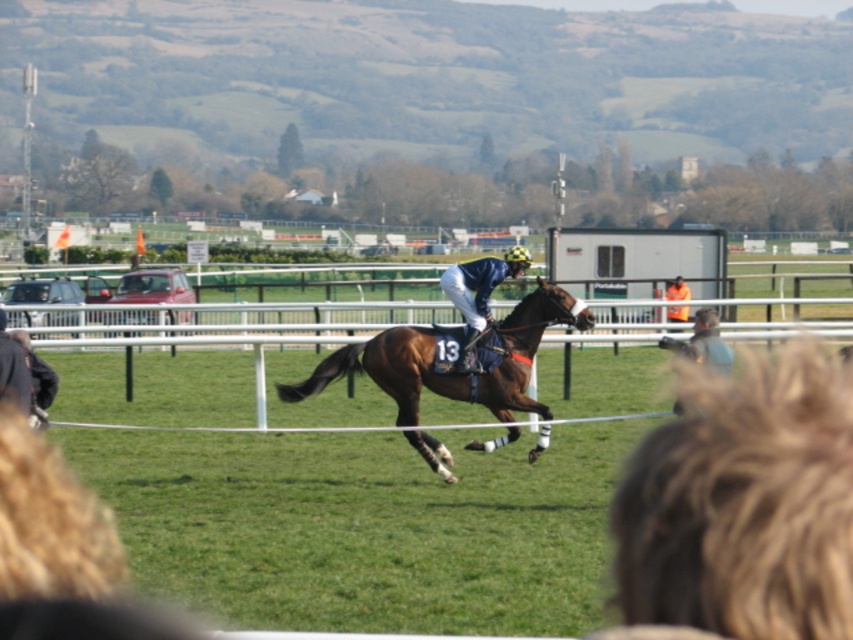
Question: Does blue fabric jockey at center have a larger size compared to orange fabric at center?

Choices:
 (A) yes
 (B) no

Answer: (A)

Question: Does shiny brown horse at center have a greater width compared to orange fabric at center?

Choices:
 (A) yes
 (B) no

Answer: (A)

Question: Which point appears farthest from the camera in this image?

Choices:
 (A) (405, 362)
 (B) (691, 580)
 (C) (460, 282)
 (D) (672, 292)

Answer: (D)

Question: Which point is closer to the camera?

Choices:
 (A) (676, 321)
 (B) (527, 257)
 (C) (525, 298)

Answer: (B)

Question: Which point appears closest to the camera in this image?

Choices:
 (A) (453, 280)
 (B) (724, 577)

Answer: (B)

Question: Can you confirm if blue fabric jockey at center is positioned to the right of orange fabric at center?

Choices:
 (A) no
 (B) yes

Answer: (A)